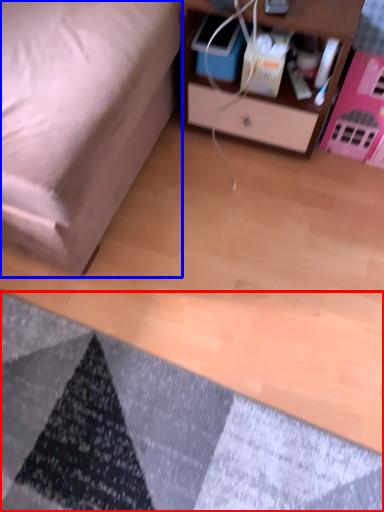
Question: Which of the following is the farthest to the observer, mat (highlighted by a red box) or furniture (highlighted by a blue box)?

Choices:
 (A) mat
 (B) furniture

Answer: (A)